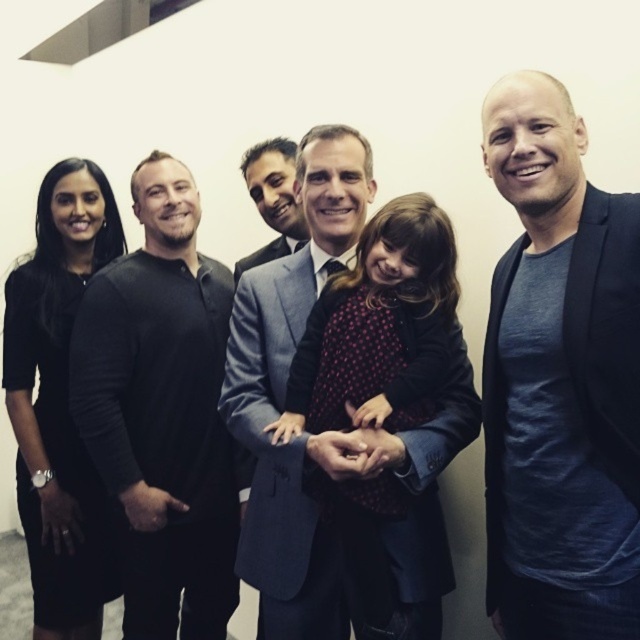
You are organizing a photoshoot and need to ensure that the polka dot fabric dress at center and the gray suit at center are visible in the frame. Given that the camera has a fixed width, which clothing item requires more horizontal space to be fully captured?

The polka dot fabric dress at center requires more horizontal space because its width is larger than the gray suit at center.

You are standing in the room and want to place a small decoration exactly at the point with coordinates [163,412]. Which object from the scene should you place it on?

The point with coordinates [163,412] is on the black matte shirt at left, so you should place the decoration on the black matte shirt at left.

Looking at this image, you are standing at the position of point (221, 358) and want to move to the position of point (520, 168). Which direction should you face to walk towards your destination?

To move from point (221, 358) to point (520, 168), you should face towards the upper left direction since point (520, 168) is in front of point (221, 358).